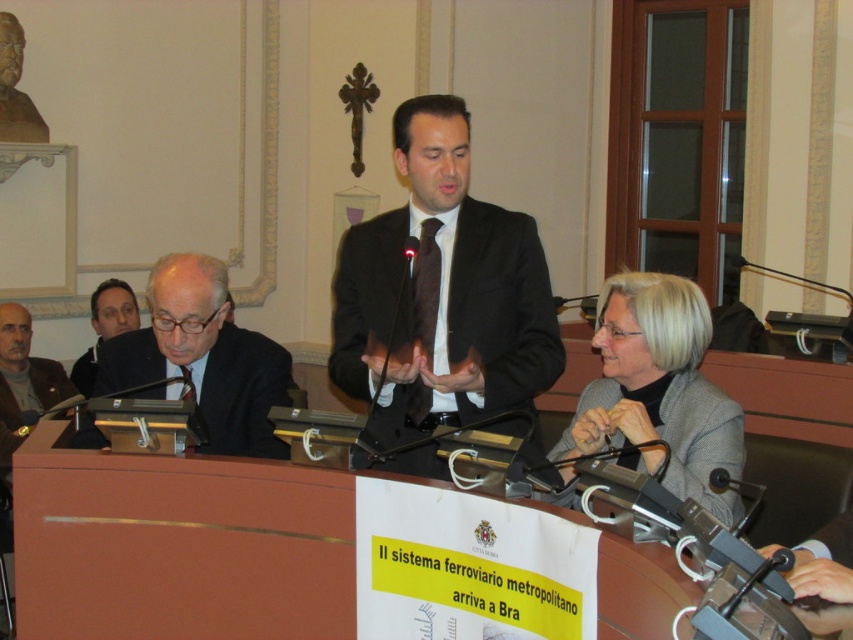
Question: Among these points, which one is farthest from the camera?

Choices:
 (A) (12, 378)
 (B) (181, 595)
 (C) (368, 356)

Answer: (A)

Question: Considering the real-world distances, which object is farthest from the gray wool sweater at left?

Choices:
 (A) wooden podium at center
 (B) gray woolen jacket at lower right

Answer: (B)

Question: Considering the real-world distances, which object is farthest from the gray woolen jacket at lower right?

Choices:
 (A) wooden podium at center
 (B) black suit at center
 (C) gray wool sweater at left

Answer: (C)

Question: Where is black suit at center located in relation to black suit at left in the image?

Choices:
 (A) right
 (B) left

Answer: (A)

Question: Does wooden podium at center have a larger size compared to black suit at center?

Choices:
 (A) no
 (B) yes

Answer: (A)

Question: Can you confirm if black suit at center is positioned to the left of gray wool sweater at left?

Choices:
 (A) yes
 (B) no

Answer: (B)